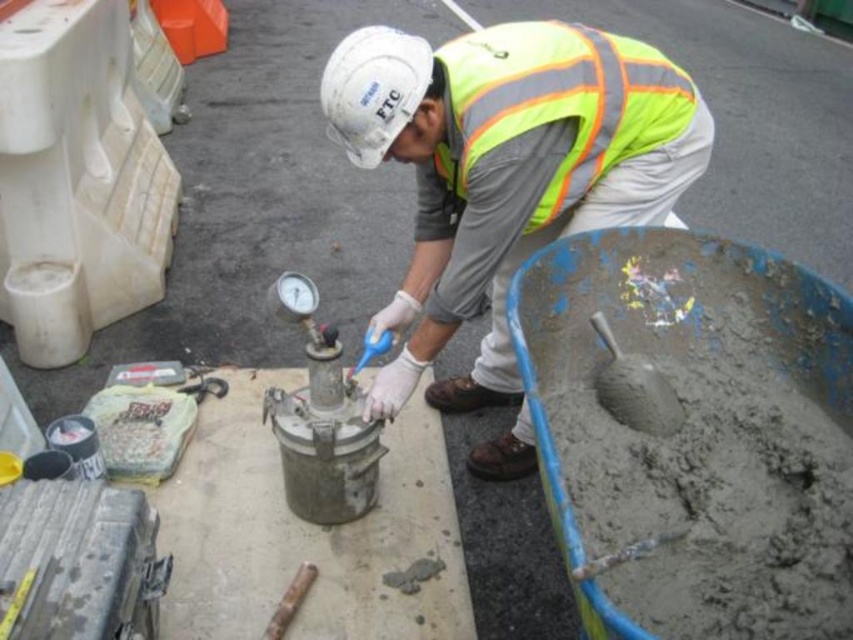
Between point (486, 129) and point (399, 122), which one is positioned behind?

Positioned behind is point (399, 122).

Is high-visibility fabric safety vest at center thinner than white hard hat at upper center?

No, high-visibility fabric safety vest at center is not thinner than white hard hat at upper center.

Image resolution: width=853 pixels, height=640 pixels. Find the location of `high-visibility fabric safety vest at center`. high-visibility fabric safety vest at center is located at coordinates (560, 100).

Does reflective yellow-green safety vest at center appear over white hard hat at upper center?

Actually, reflective yellow-green safety vest at center is below white hard hat at upper center.

Does reflective yellow-green safety vest at center have a greater height compared to white hard hat at upper center?

Yes.

Is point (495, 442) in front of point (357, 113)?

No, it is not.

At what (x,y) coordinates should I click in order to perform the action: click on reflective yellow-green safety vest at center. Please return your answer as a coordinate pair (x, y). The width and height of the screenshot is (853, 640). Looking at the image, I should click on (506, 177).

Between reflective yellow-green safety vest at center and smooth concrete shovel at lower right, which one has less height?

With less height is smooth concrete shovel at lower right.

Does reflective yellow-green safety vest at center appear over smooth concrete shovel at lower right?

Correct, reflective yellow-green safety vest at center is located above smooth concrete shovel at lower right.

Between point (473, 45) and point (648, 410), which one is positioned behind?

The point (473, 45) is behind.

Identify the location of reflective yellow-green safety vest at center. (506, 177).